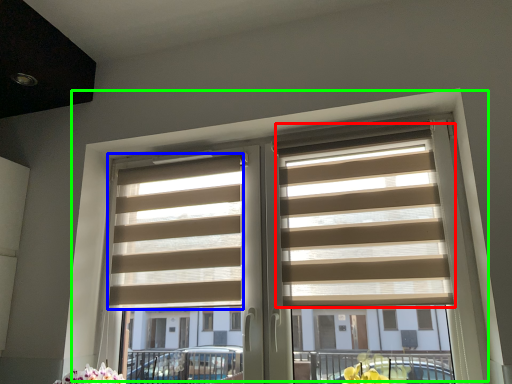
Question: Which is farther away from blind (highlighted by a red box)? blind (highlighted by a blue box) or window (highlighted by a green box)?

Choices:
 (A) blind
 (B) window

Answer: (A)